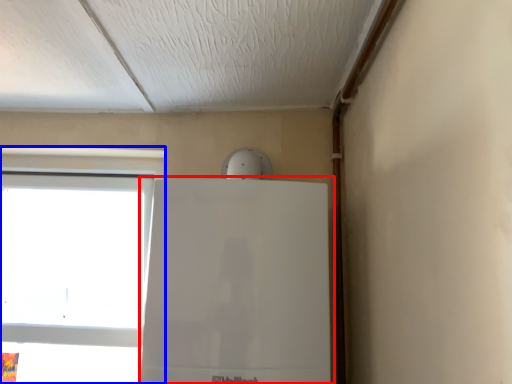
Question: Which point is further to the camera, fridge (highlighted by a red box) or window (highlighted by a blue box)?

Choices:
 (A) fridge
 (B) window

Answer: (B)